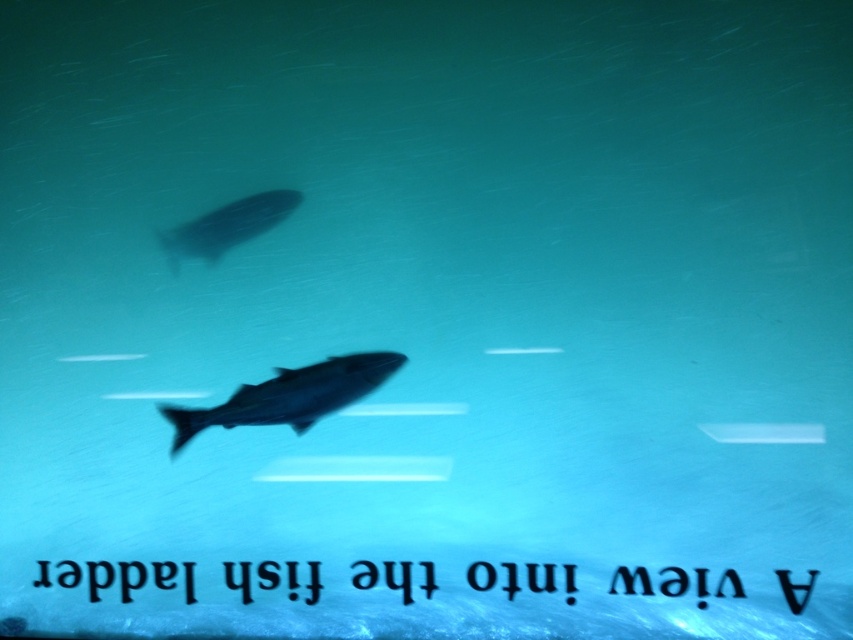
Between silvery metallic fish at center and silvery metallic fish at upper center, which one appears on the right side from the viewer's perspective?

silvery metallic fish at center

Is point (262, 417) positioned in front of point (283, 198)?

Yes, point (262, 417) is in front of point (283, 198).

Identify the location of silvery metallic fish at center. (289, 396).